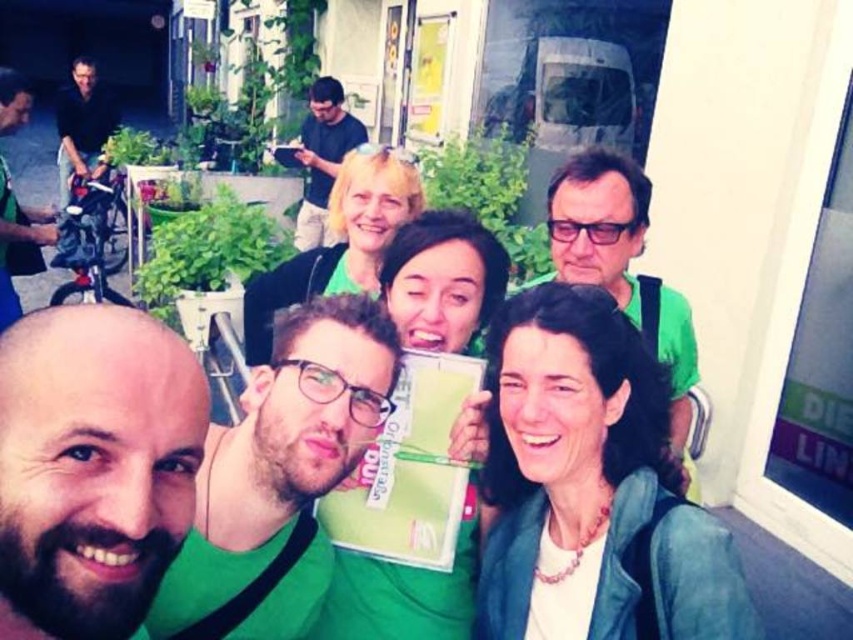
You are organizing a charity event and need to arrange shirts for volunteers. You have a green matte shirt at upper center and a black matte shirt at left. Which shirt should you choose if you need a larger size for a volunteer who prefers a bigger fit?

The black matte shirt at left is larger in size compared to the green matte shirt at upper center, so you should choose the black matte shirt at left for the volunteer who prefers a bigger fit.

You are designing a photo layout where the green matte shirt at upper center and the black cotton shirt at upper center must be placed side by side. Which shirt should be placed on the left to ensure they fit within a 1.2 meter wide frame?

The green matte shirt at upper center has a lesser width compared to the black cotton shirt at upper center, so placing the narrower green matte shirt at upper center on the left would allow both to fit within the 1.2 meter wide frame.

You are a photographer trying to capture a group photo of the six individuals in the scene. You notice the green matte shirt at upper center and the black cotton shirt at upper center. Which shirt should you adjust to ensure both are visible in the frame?

The green matte shirt at upper center is shorter than the black cotton shirt at upper center. To ensure both are visible, you should adjust the green matte shirt at upper center to be positioned higher or ask the person wearing it to stand on a slight elevation.